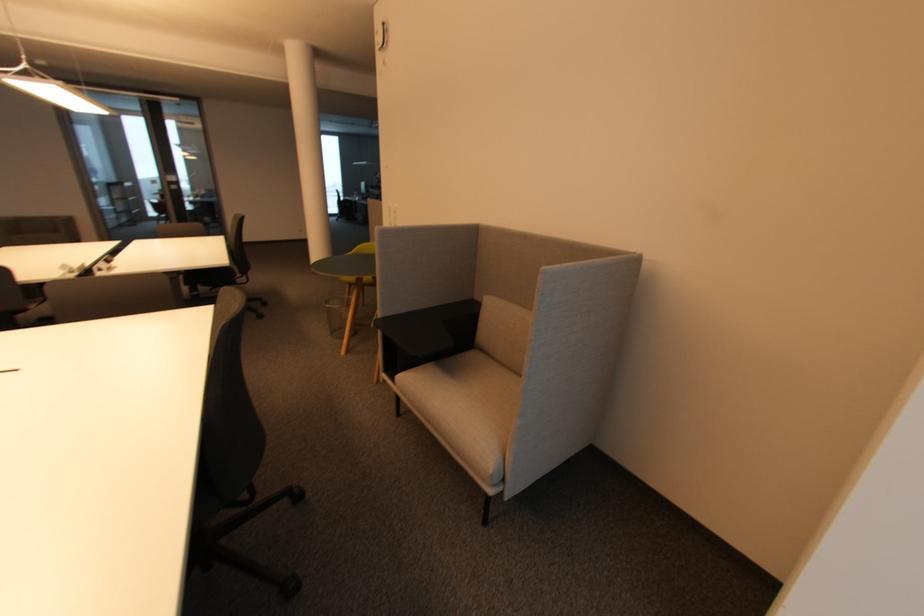
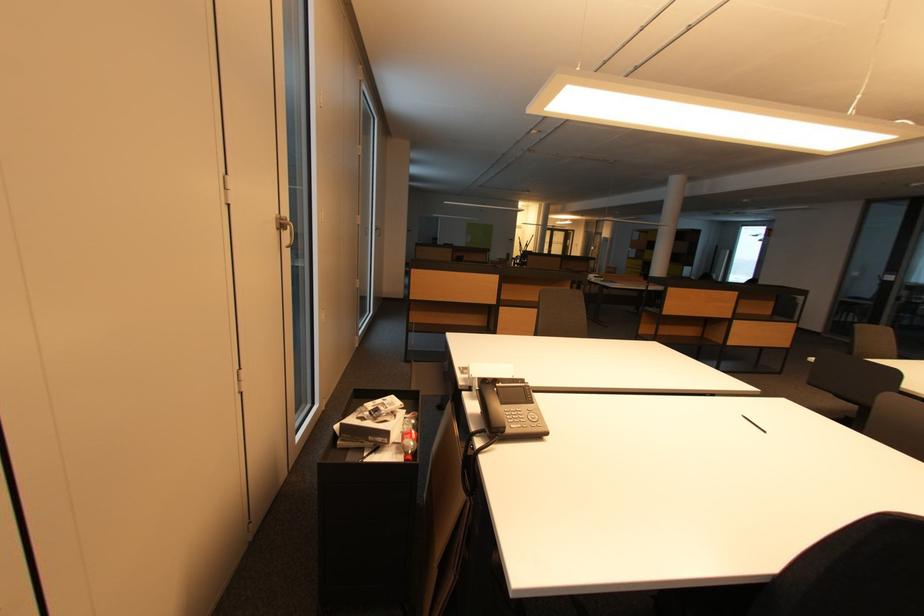
How did the camera likely rotate?

The camera rotated toward left-down.